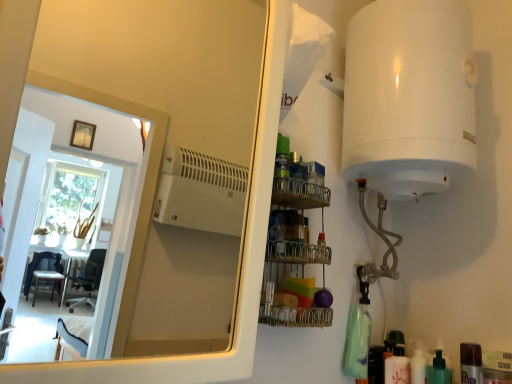
Question: From a real-world perspective, is translucent plastic bottle at lower right, the fourth toiletry from the right, physically below white glossy mirror at upper left?

Choices:
 (A) no
 (B) yes

Answer: (B)

Question: Is translucent plastic bottle at lower right, which appears as the 1th toiletry when viewed from the left, shorter than white glossy mirror at upper left?

Choices:
 (A) no
 (B) yes

Answer: (B)

Question: Is translucent plastic bottle at lower right, which appears as the 1th toiletry when viewed from the left, further to the viewer compared to white glossy mirror at upper left?

Choices:
 (A) yes
 (B) no

Answer: (A)

Question: Can you confirm if translucent plastic bottle at lower right, which appears as the 1th toiletry when viewed from the left, is thinner than white glossy mirror at upper left?

Choices:
 (A) no
 (B) yes

Answer: (B)

Question: Is translucent plastic bottle at lower right, the fourth toiletry from the right, to the right of white glossy mirror at upper left from the viewer's perspective?

Choices:
 (A) yes
 (B) no

Answer: (A)

Question: From a real-world perspective, is translucent plastic bottle at lower right, which is the fourth toiletry in left-to-right order, above or below white glossy mirror at upper left?

Choices:
 (A) below
 (B) above

Answer: (A)

Question: Is translucent plastic bottle at lower right, which is the fourth toiletry in left-to-right order, situated inside white glossy mirror at upper left or outside?

Choices:
 (A) outside
 (B) inside

Answer: (A)

Question: From the image's perspective, is translucent plastic bottle at lower right, which is the fourth toiletry in left-to-right order, above or below white glossy mirror at upper left?

Choices:
 (A) above
 (B) below

Answer: (B)

Question: Considering the positions of translucent plastic bottle at lower right, which is the fourth toiletry in left-to-right order, and white glossy mirror at upper left in the image, is translucent plastic bottle at lower right, which is the fourth toiletry in left-to-right order, bigger or smaller than white glossy mirror at upper left?

Choices:
 (A) big
 (B) small

Answer: (B)

Question: From the image's perspective, relative to white glossy mirror at upper left, is green matte pump bottle at lower right, which is the 3th toiletry in left-to-right order, above or below?

Choices:
 (A) above
 (B) below

Answer: (B)

Question: From their relative heights in the image, would you say green matte pump bottle at lower right, which is the 3th toiletry in left-to-right order, is taller or shorter than white glossy mirror at upper left?

Choices:
 (A) tall
 (B) short

Answer: (B)

Question: In the image, is green matte pump bottle at lower right, which is the 3th toiletry in left-to-right order, positioned in front of or behind white glossy mirror at upper left?

Choices:
 (A) front
 (B) behind

Answer: (B)

Question: Based on their sizes in the image, would you say green matte pump bottle at lower right, which is the 3th toiletry in left-to-right order, is bigger or smaller than white glossy mirror at upper left?

Choices:
 (A) big
 (B) small

Answer: (B)

Question: In the image, is green matte pump bottle at lower right, arranged as the 2th toiletry when viewed from the right, positioned in front of or behind white glossy bottle at lower right, the third toiletry from the right?

Choices:
 (A) front
 (B) behind

Answer: (A)

Question: From the image's perspective, is green matte pump bottle at lower right, arranged as the 2th toiletry when viewed from the right, positioned above or below white glossy bottle at lower right, the second toiletry positioned from the left?

Choices:
 (A) below
 (B) above

Answer: (B)